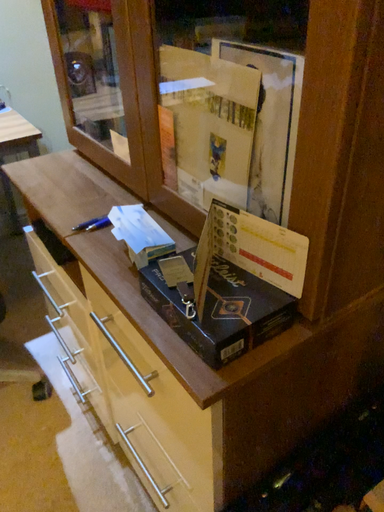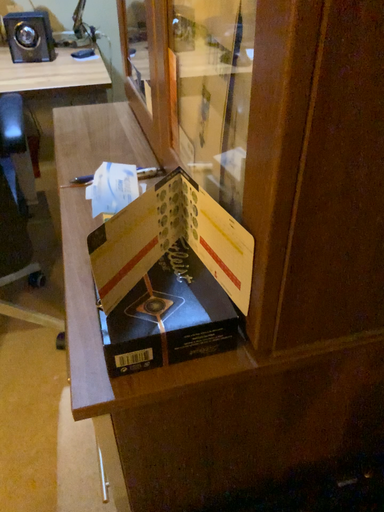
Question: Which way did the camera rotate in the video?

Choices:
 (A) rotated left
 (B) rotated right

Answer: (A)